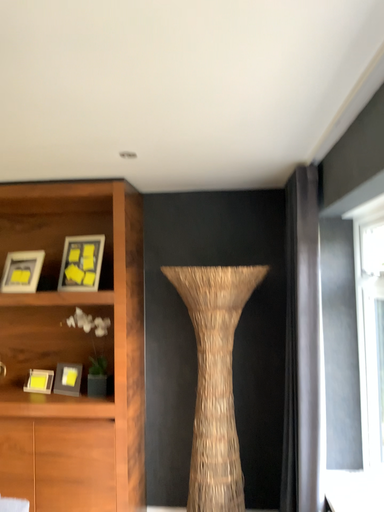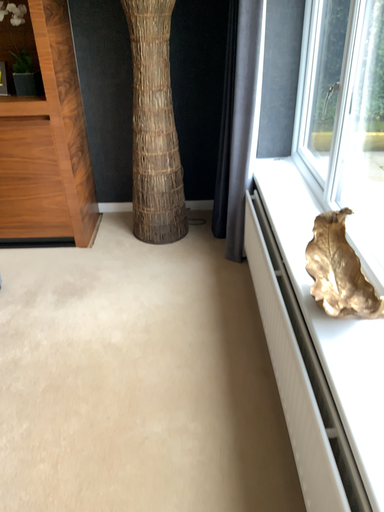
Question: Which way did the camera rotate in the video?

Choices:
 (A) rotated downward
 (B) rotated upward

Answer: (A)